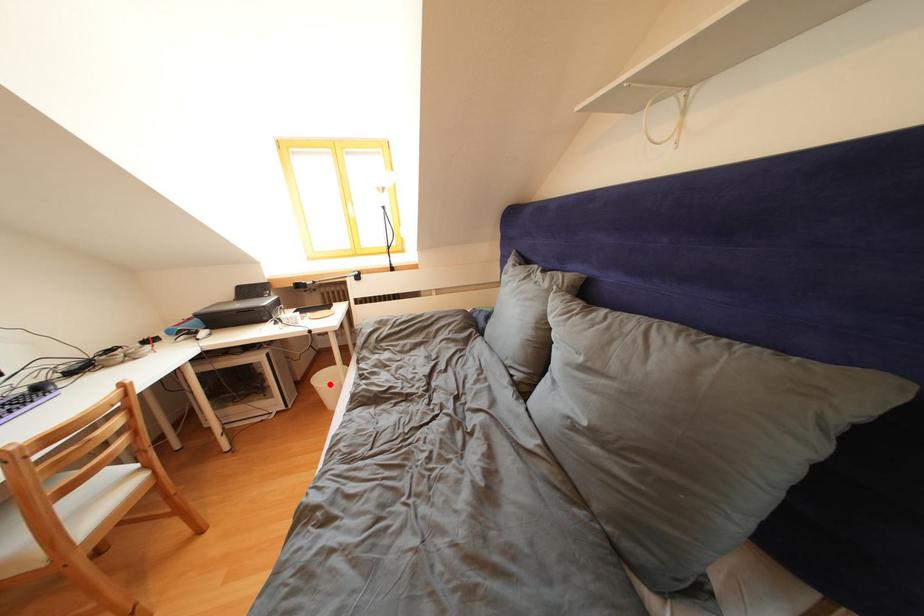
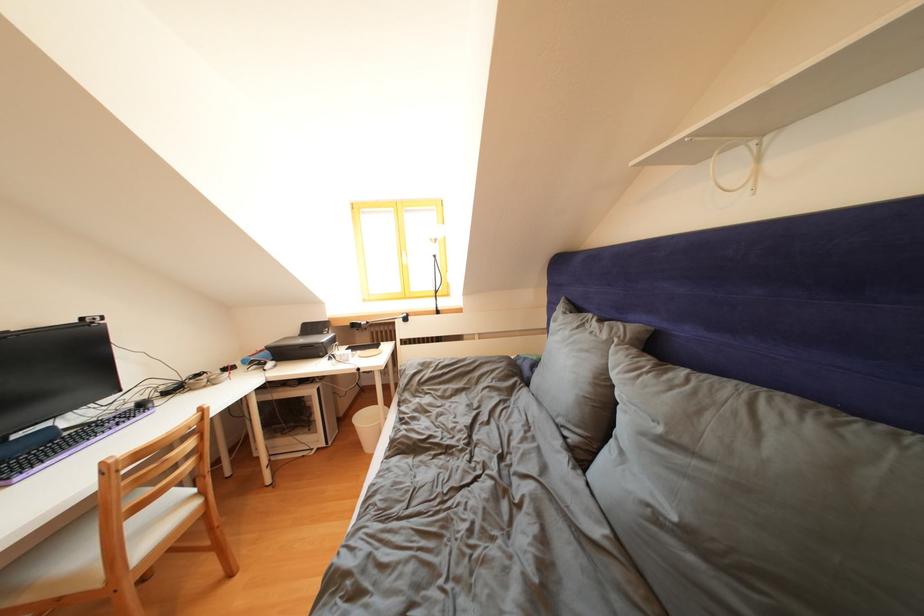
Question: I am providing you with two images of the same scene from different viewpoints. A red point is shown in image1. For the corresponding object point in image2, is it positioned nearer or farther from the camera?

Choices:
 (A) Nearer
 (B) Farther

Answer: (A)